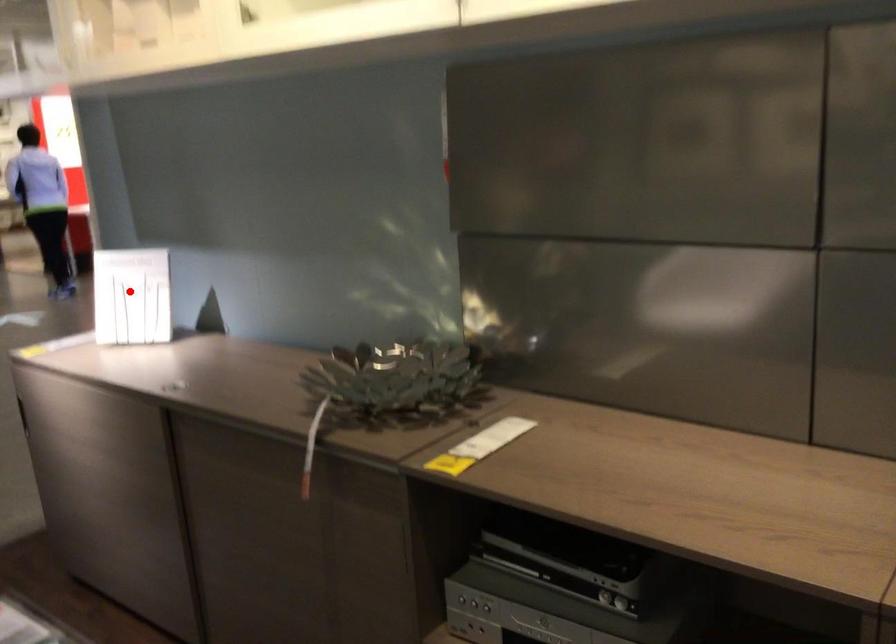
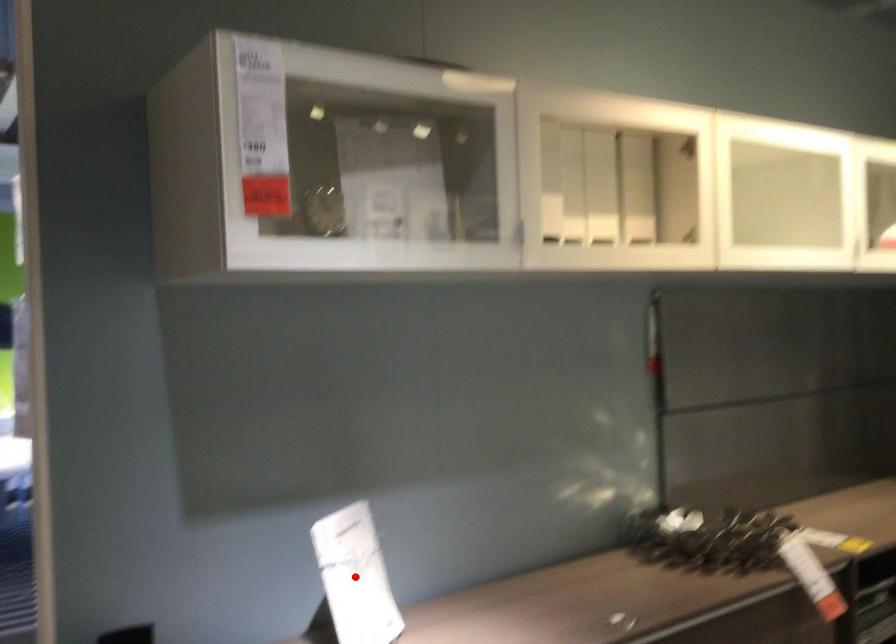
I am providing you with two images of the same scene from different viewpoints. A red point is marked on the first image and another point is marked on the second image. Does the point marked in image1 correspond to the same location as the one in image2?

Yes